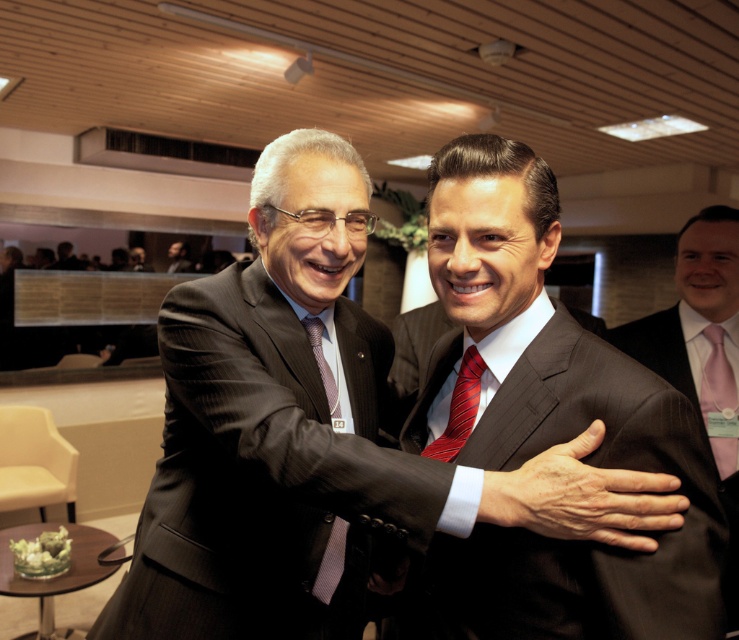
Question: Does dark pinstripe suit at center come in front of smooth black suit at center?

Choices:
 (A) yes
 (B) no

Answer: (A)

Question: Estimate the real-world distances between objects in this image. Which object is closer to the dark brown pinstripe suit at center?

Choices:
 (A) pink satin tie at center
 (B) red striped tie at center
 (C) striped silk tie at center
 (D) dark gray pinstripe suit at center

Answer: (B)

Question: Is dark gray pinstripe suit at center wider than striped silk tie at center?

Choices:
 (A) no
 (B) yes

Answer: (B)

Question: Which is nearer to the dark pinstripe suit at center?

Choices:
 (A) pink satin tie at center
 (B) smooth black suit at center

Answer: (A)

Question: Which of these objects is positioned closest to the red striped tie at center?

Choices:
 (A) dark gray pinstripe suit at center
 (B) smooth black suit at center
 (C) pinstriped suit at center
 (D) pink satin tie at center

Answer: (A)

Question: Is dark pinstripe suit at center bigger than smooth black suit at center?

Choices:
 (A) yes
 (B) no

Answer: (A)